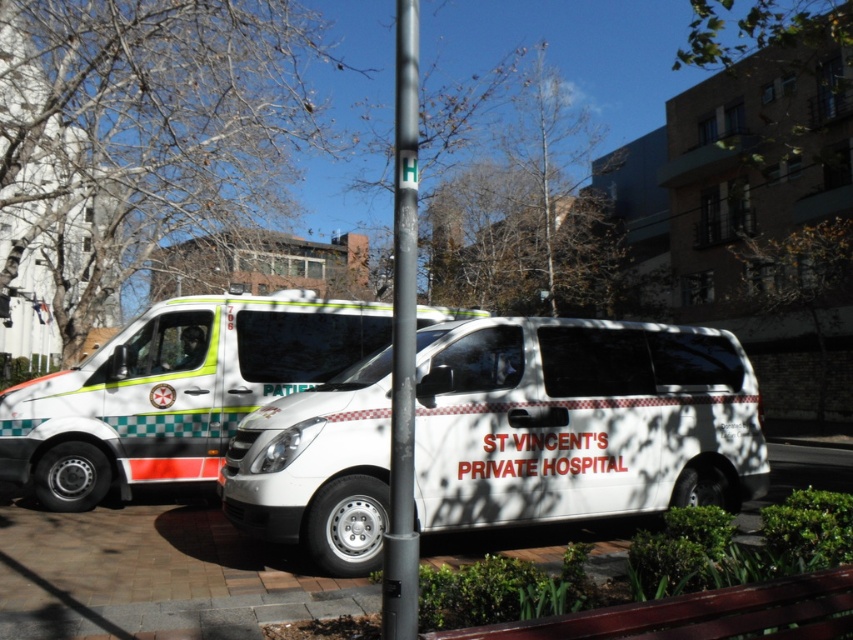
Based on the photo, who is shorter, white brick pavement at center or white glossy van at left?

Standing shorter between the two is white brick pavement at center.

Can you confirm if white brick pavement at center is positioned to the right of white glossy van at left?

Indeed, white brick pavement at center is positioned on the right side of white glossy van at left.

Is point (143, 627) positioned after point (67, 492)?

That is False.

At what (x,y) coordinates should I click in order to perform the action: click on white brick pavement at center. Please return your answer as a coordinate pair (x, y). This screenshot has width=853, height=640. Looking at the image, I should click on (154, 573).

Which is more to the left, white glossy van at center or white brick pavement at center?

Positioned to the left is white glossy van at center.

The height and width of the screenshot is (640, 853). Describe the element at coordinates (579, 420) in the screenshot. I see `white glossy van at center` at that location.

Does point (544, 513) come in front of point (247, 616)?

No, (544, 513) is behind (247, 616).

Locate an element on the screen. The image size is (853, 640). white glossy van at center is located at coordinates (579, 420).

Is white brick pavement at center to the left of black smooth pole at center from the viewer's perspective?

In fact, white brick pavement at center is to the right of black smooth pole at center.

Who is more forward, [32,516] or [405,365]?

Point [405,365] is in front.

This screenshot has width=853, height=640. What do you see at coordinates (154, 573) in the screenshot?
I see `white brick pavement at center` at bounding box center [154, 573].

The width and height of the screenshot is (853, 640). In order to click on white brick pavement at center in this screenshot , I will do `click(154, 573)`.